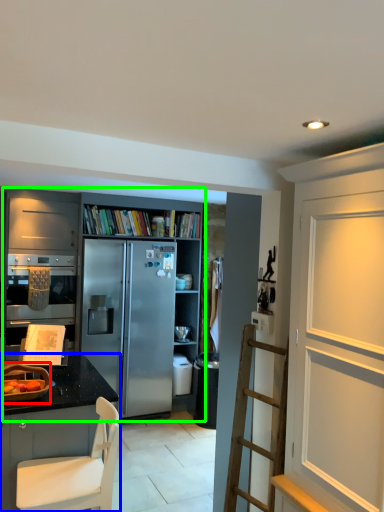
Question: Which is farther away from appliance (highlighted by a red box)? cabinetry (highlighted by a blue box) or cabinetry (highlighted by a green box)?

Choices:
 (A) cabinetry
 (B) cabinetry

Answer: (B)